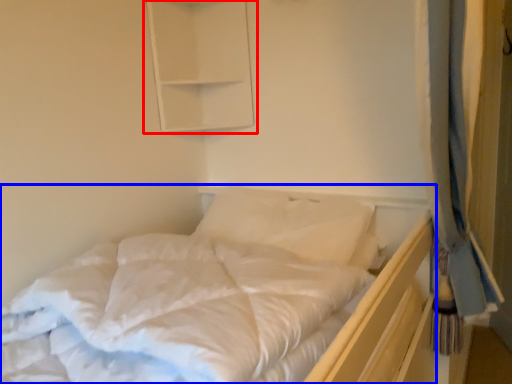
Question: Which object is closer to the camera taking this photo, medicine cabinet (highlighted by a red box) or bed (highlighted by a blue box)?

Choices:
 (A) medicine cabinet
 (B) bed

Answer: (B)